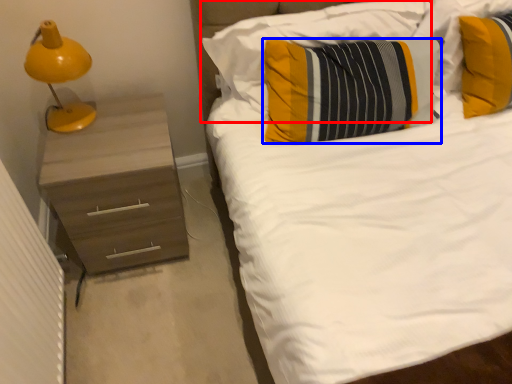
Question: Which of the following is the closest to the observer, pillow (highlighted by a red box) or pillow (highlighted by a blue box)?

Choices:
 (A) pillow
 (B) pillow

Answer: (B)